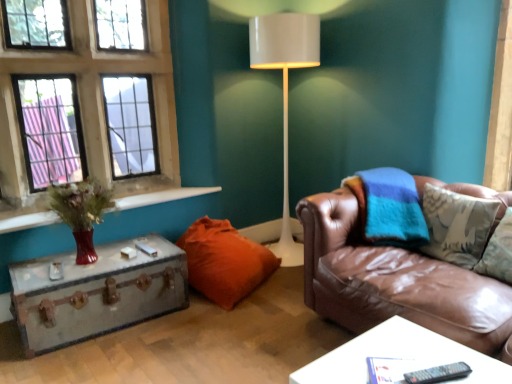
In order to click on vacant point above metallic suitcase at left, the 1th table in the back-to-front sequence (from a real-world perspective) in this screenshot , I will do `click(77, 264)`.